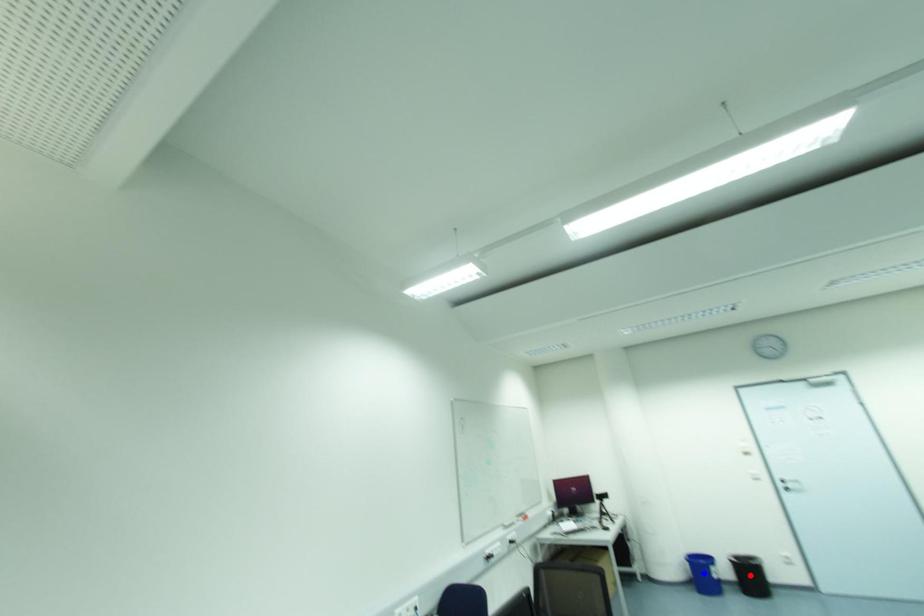
Question: Two points are marked on the image. Which point is closer to the camera?

Choices:
 (A) Blue point is closer.
 (B) Red point is closer.

Answer: (B)